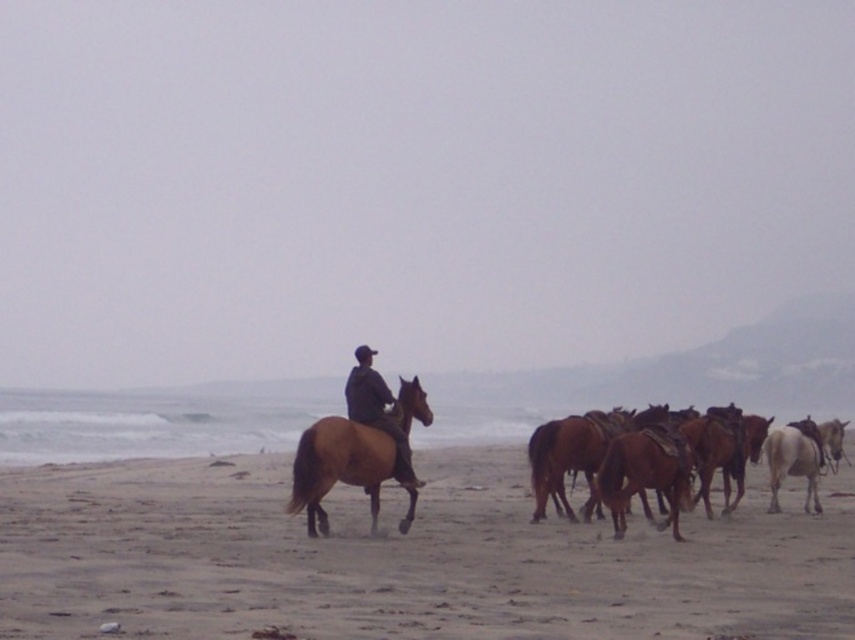
Question: Is the position of sandy beach at lower center less distant than that of brown leather horse at lower right?

Choices:
 (A) no
 (B) yes

Answer: (B)

Question: Estimate the real-world distances between objects in this image. Which object is farther from the brown glossy horse at center?

Choices:
 (A) brown leather jacket at center
 (B) brown leather horse at lower right
 (C) sandy beach at lower center

Answer: (C)

Question: Does brown glossy horse at center appear on the left side of brown leather jacket at center?

Choices:
 (A) yes
 (B) no

Answer: (A)

Question: Is sandy beach at lower center to the right of brown glossy horse at center from the viewer's perspective?

Choices:
 (A) no
 (B) yes

Answer: (B)

Question: Which point is closer to the camera taking this photo?

Choices:
 (A) (372, 408)
 (B) (310, 509)
 (C) (558, 467)

Answer: (B)

Question: Which of these objects is positioned closest to the brown leather horse at lower right?

Choices:
 (A) sandy beach at lower center
 (B) brown leather jacket at center

Answer: (B)